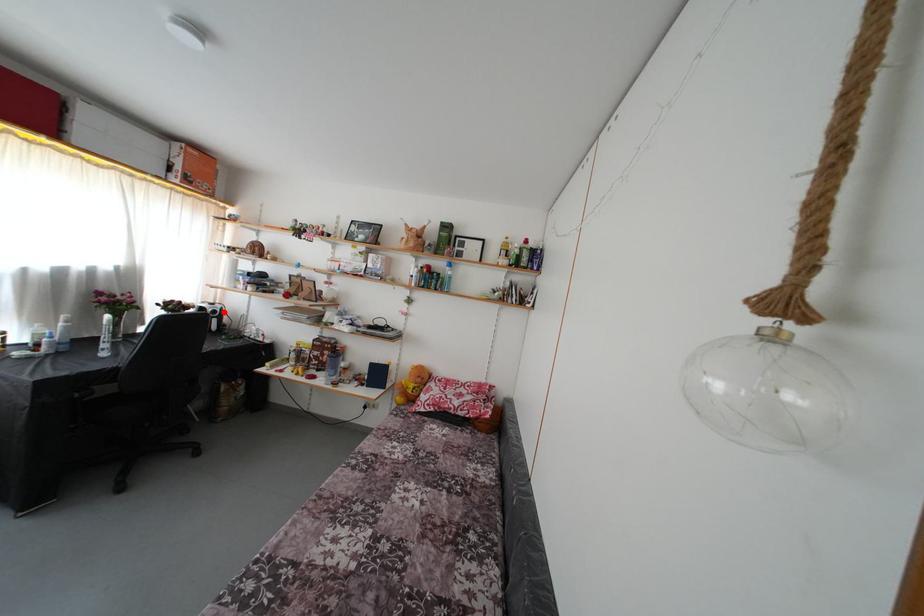
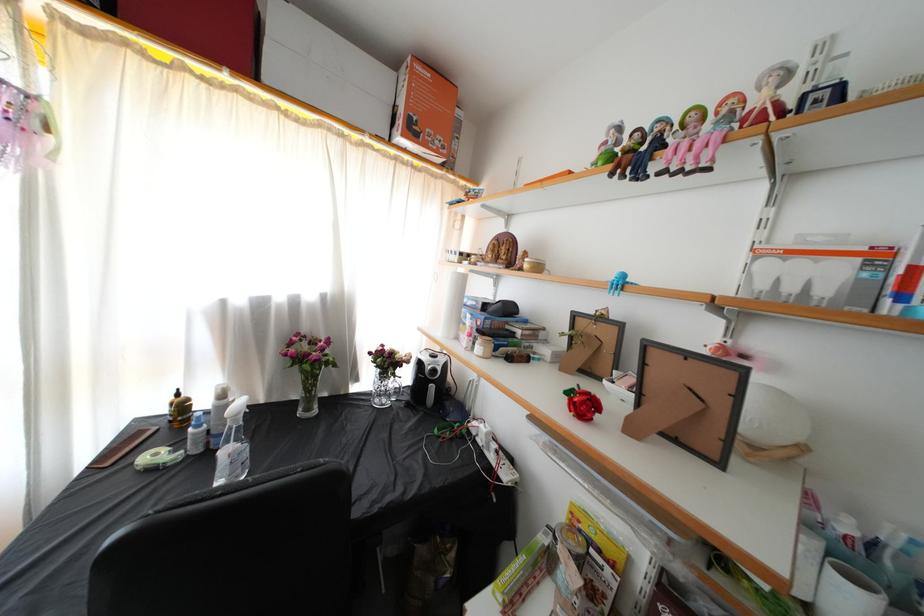
Find the pixel in the second image that matches the highlighted location in the first image.

(446, 365)